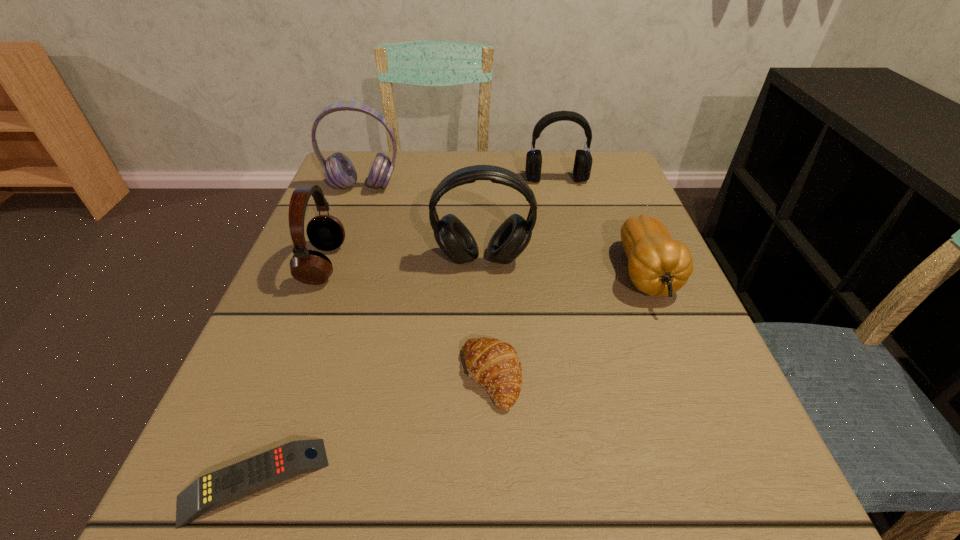
At what (x,y) coordinates should I click in order to perform the action: click on vacant space at the near edge of the desktop. Please return your answer as a coordinate pair (x, y). Looking at the image, I should click on (526, 497).

What are the coordinates of `free point at the left edge` in the screenshot? It's located at (278, 308).

At what (x,y) coordinates should I click in order to perform the action: click on free location at the right edge. Please return your answer as a coordinate pair (x, y). The width and height of the screenshot is (960, 540). Looking at the image, I should click on (628, 352).

Image resolution: width=960 pixels, height=540 pixels. Identify the location of vacant space at the far left corner of the desktop. (356, 199).

Locate an element on the screen. vacant space at the far right corner is located at coordinates (603, 192).

You are a GUI agent. You are given a task and a screenshot of the screen. Output one action in this format:
    pyautogui.click(x=<x>, y=<y>)
    Task: Click on the vacant space at the near right corner
    The height and width of the screenshot is (540, 960).
    Given the screenshot: What is the action you would take?
    pyautogui.click(x=746, y=528)

Where is `free space between the gourd and the second nearest object`? free space between the gourd and the second nearest object is located at coordinates (568, 326).

Locate an element on the screen. vacant point located between the remote control and the third headset from left to right is located at coordinates (369, 370).

Image resolution: width=960 pixels, height=540 pixels. What are the coordinates of `object that stands as the fifth closest to the sixth tallest object` in the screenshot? It's located at (339, 171).

Point out which object is positioned as the fifth nearest to the rightmost headset. Please provide its 2D coordinates. Your answer should be formatted as a tuple, i.e. [(x, y)], where the tuple contains the x and y coordinates of a point satisfying the conditions above.

[(494, 364)]